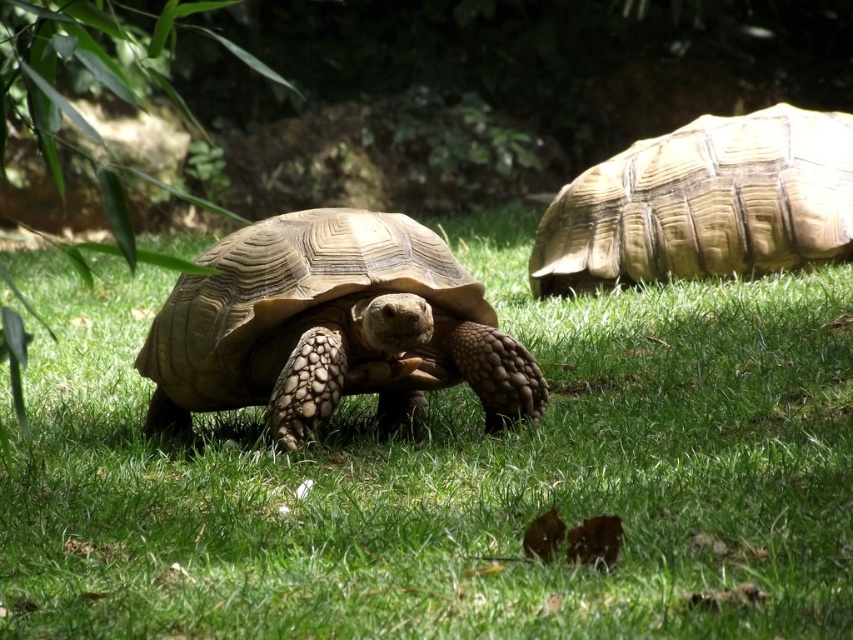
Question: Can you confirm if green grass at center is positioned to the left of light brown textured shell at right?

Choices:
 (A) yes
 (B) no

Answer: (A)

Question: Which of the following is the closest to the observer?

Choices:
 (A) (386, 275)
 (B) (341, 580)
 (C) (732, 116)

Answer: (B)

Question: Does green grass at center appear under leather-like brown tortoise at center?

Choices:
 (A) no
 (B) yes

Answer: (B)

Question: Which point is closer to the camera taking this photo?

Choices:
 (A) (432, 387)
 (B) (300, 593)
 (C) (775, 163)

Answer: (B)

Question: Among these objects, which one is nearest to the camera?

Choices:
 (A) green grass at center
 (B) leather-like brown tortoise at center
 (C) light brown textured shell at right

Answer: (A)

Question: Considering the relative positions of leather-like brown tortoise at center and light brown textured shell at right in the image provided, where is leather-like brown tortoise at center located with respect to light brown textured shell at right?

Choices:
 (A) above
 (B) below

Answer: (B)